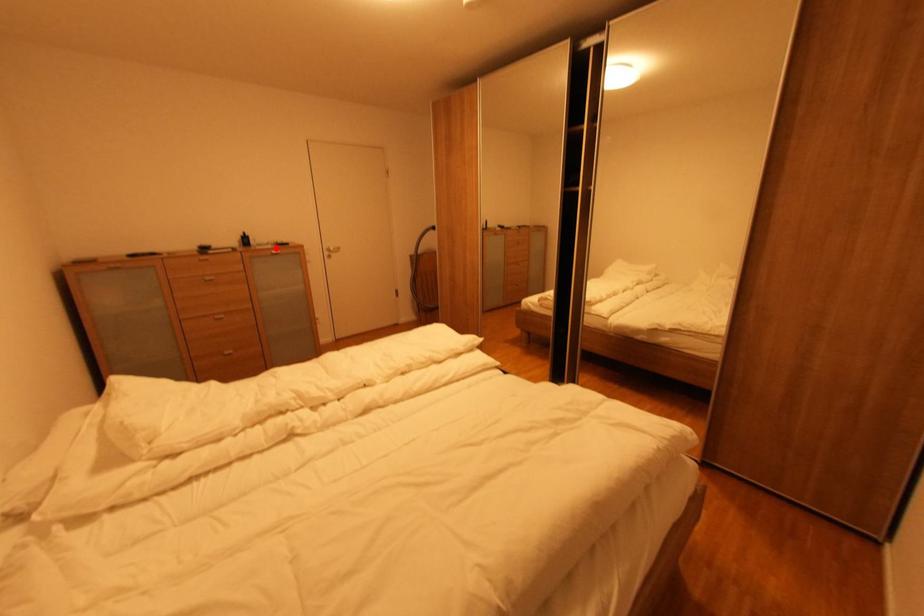
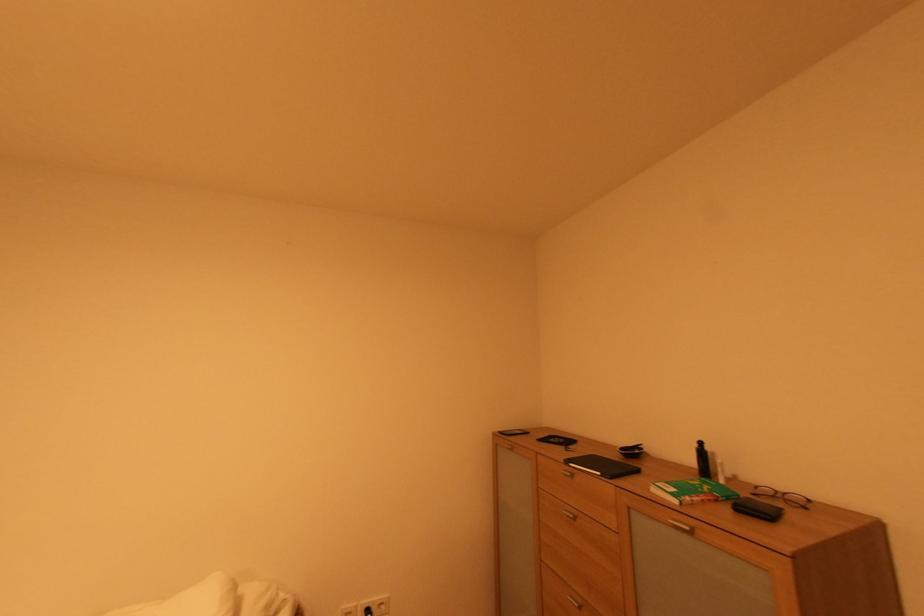
In the second image, find the point that corresponds to the highlighted location in the first image.

(682, 503)